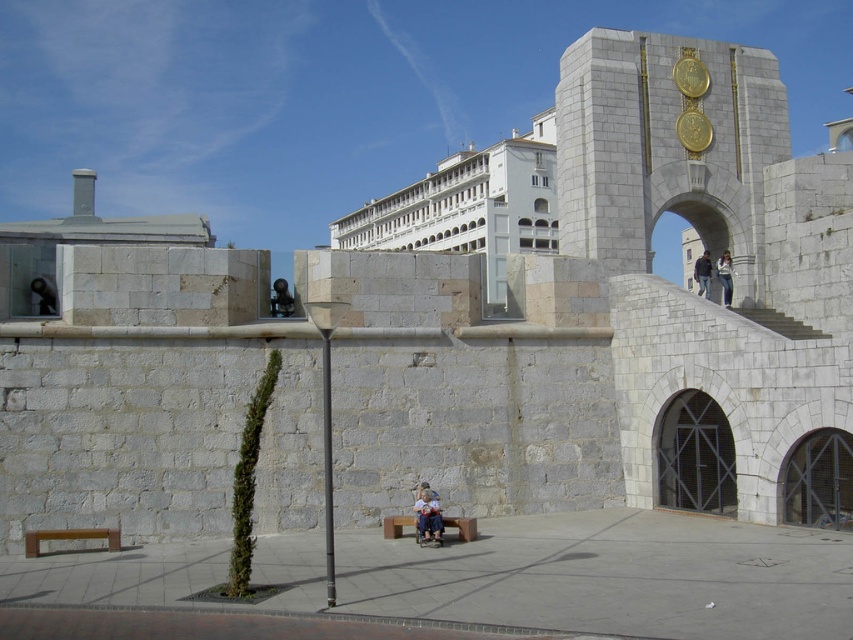
You are standing at the entrance of the historical stone structure and want to sit down. Where exactly is the red wooden bench at lower center located?

The red wooden bench at lower center is located at point coordinates of [462,525].